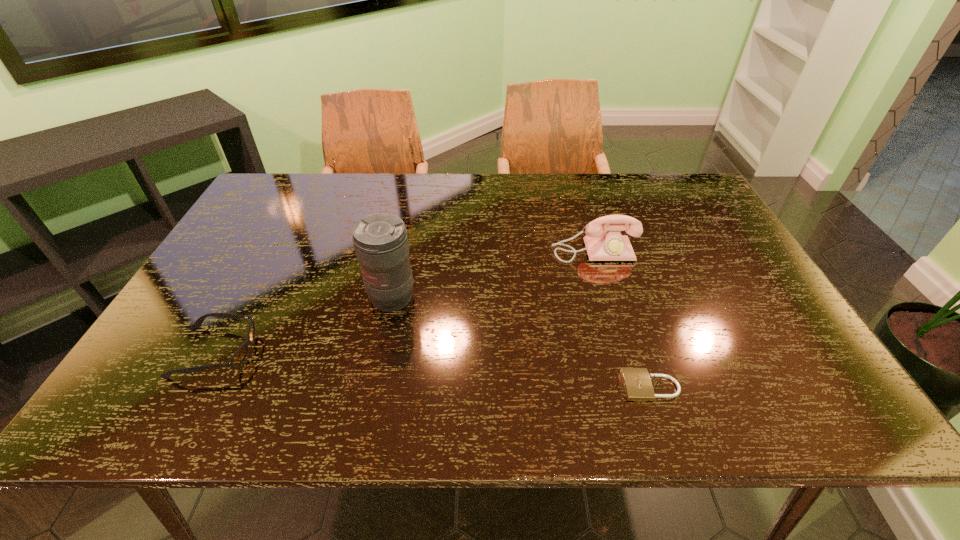
In order to click on free point that satisfies the following two spatial constraints: 1. on the side of the telephoto lens where the control switches are located; 2. on the front-facing side of the leftmost object in this screenshot , I will do `click(381, 352)`.

Identify the location of vacant point that satisfies the following two spatial constraints: 1. on the dial of the telephone; 2. on the front-facing side of the second shortest object. (624, 352).

Locate an element on the screen. free space that satisfies the following two spatial constraints: 1. on the dial of the farthest object; 2. on the front-facing side of the spectacles is located at coordinates (624, 352).

The image size is (960, 540). Identify the location of vacant space that satisfies the following two spatial constraints: 1. on the side of the second farthest object where the control switches are located; 2. on the front-facing side of the second shortest object. click(x=381, y=352).

Where is `free space that satisfies the following two spatial constraints: 1. on the front-facing side of the second shortest object; 2. on the right side of the shortest object`? The image size is (960, 540). free space that satisfies the following two spatial constraints: 1. on the front-facing side of the second shortest object; 2. on the right side of the shortest object is located at coordinates (197, 387).

Where is `vacant space that satisfies the following two spatial constraints: 1. on the dial of the telephone; 2. on the front-facing side of the third tallest object`? This screenshot has height=540, width=960. vacant space that satisfies the following two spatial constraints: 1. on the dial of the telephone; 2. on the front-facing side of the third tallest object is located at coordinates (624, 352).

Find the location of `vacant space that satisfies the following two spatial constraints: 1. on the front-facing side of the padlock; 2. on the right side of the third tallest object`. vacant space that satisfies the following two spatial constraints: 1. on the front-facing side of the padlock; 2. on the right side of the third tallest object is located at coordinates (197, 387).

The image size is (960, 540). In order to click on free location that satisfies the following two spatial constraints: 1. on the dial of the shortest object; 2. on the left side of the farthest object in this screenshot , I will do `click(634, 387)`.

At what (x,y) coordinates should I click in order to perform the action: click on free spot that satisfies the following two spatial constraints: 1. on the side of the third object from right to left where the control switches are located; 2. on the front-facing side of the spectacles. Please return your answer as a coordinate pair (x, y). Looking at the image, I should click on (381, 352).

You are a GUI agent. You are given a task and a screenshot of the screen. Output one action in this format:
    pyautogui.click(x=<x>, y=<y>)
    Task: Click on the vacant space that satisfies the following two spatial constraints: 1. on the side of the padlock where the control switches are located; 2. on the left side of the second farthest object
    The image size is (960, 540).
    Given the screenshot: What is the action you would take?
    pyautogui.click(x=374, y=387)